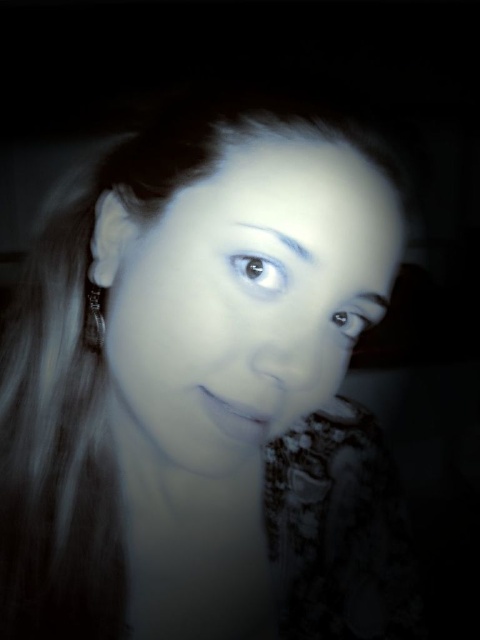
Does point (252, 273) come closer to viewer compared to point (348, 314)?

Yes, point (252, 273) is in front of point (348, 314).

Can you confirm if shiny black eye at center is bigger than shiny black eye at upper right?

No, shiny black eye at center is not bigger than shiny black eye at upper right.

Measure the distance between shiny black eye at center and camera.

shiny black eye at center is 16.24 inches from camera.

Locate an element on the screen. This screenshot has width=480, height=640. shiny black eye at center is located at coordinates (259, 272).

Who is lower down, silver metallic earring at left or shiny black eye at upper right?

shiny black eye at upper right is lower down.

Is point (84, 285) farther from camera compared to point (347, 316)?

That is True.

Who is more distant from viewer, [96,316] or [350,333]?

The point [96,316] is more distant.

Find the location of a particular element. silver metallic earring at left is located at coordinates (94, 316).

From the picture: Between smooth skin face at center and shiny black eye at center, which one appears on the right side from the viewer's perspective?

Positioned to the right is shiny black eye at center.

Image resolution: width=480 pixels, height=640 pixels. What do you see at coordinates (242, 292) in the screenshot?
I see `smooth skin face at center` at bounding box center [242, 292].

Identify the location of smooth skin face at center. The image size is (480, 640). (242, 292).